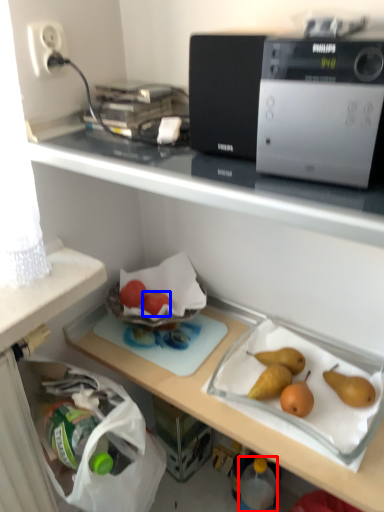
Question: Which object is closer to the camera taking this photo, bottle (highlighted by a red box) or fruit (highlighted by a blue box)?

Choices:
 (A) bottle
 (B) fruit

Answer: (A)